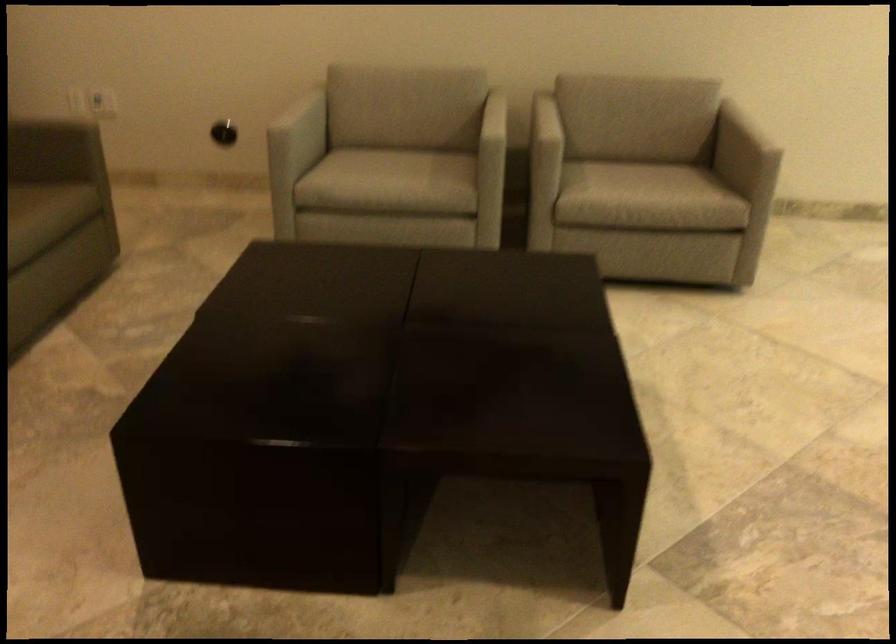
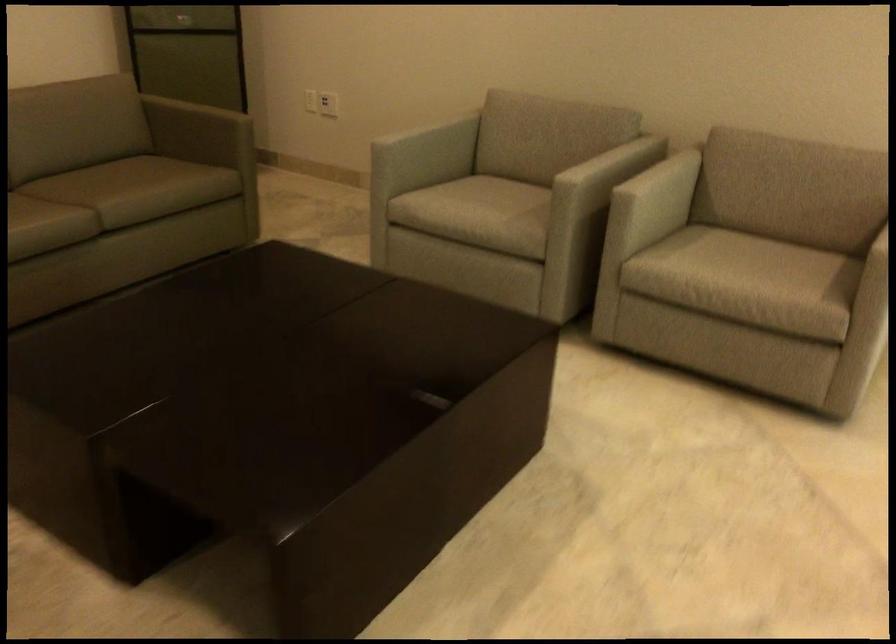
Locate, in the second image, the point that corresponds to point 454,102 in the first image.

(588, 149)